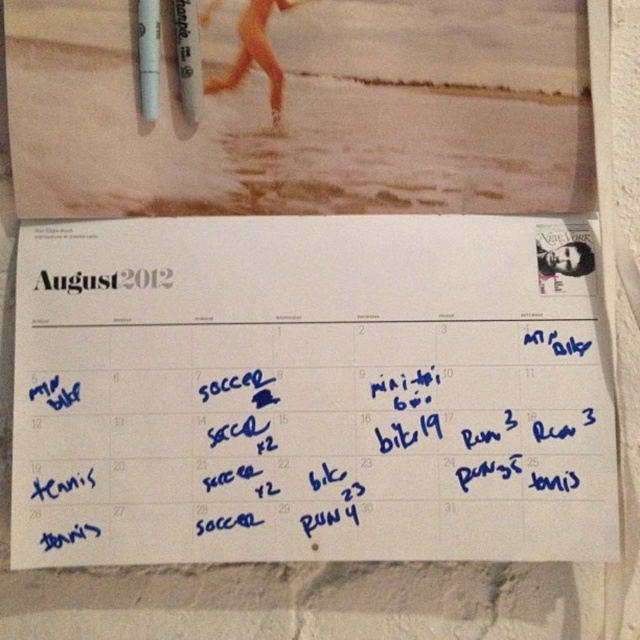
You are organizing a schedule for August 2012 and see the calendar in the image. What is the color of the calendar where the point at coordinates (310, 392) is located?

The point at coordinates (310, 392) indicates white paper at center, so the calendar at that point is white.

You are organizing a schedule and need to place a sticky note on the calendar. The sticky note is 5 cm wide. The white paper at center is located at point 0.613, 0.486. Can the sticky note fit without overlapping the handwritten notes?

The white paper at center is located at point (310, 392). Since the position is specified, but the size of the white paper and the handwritten notes aren not provided, it is impossible to determine if the sticky note will overlap.